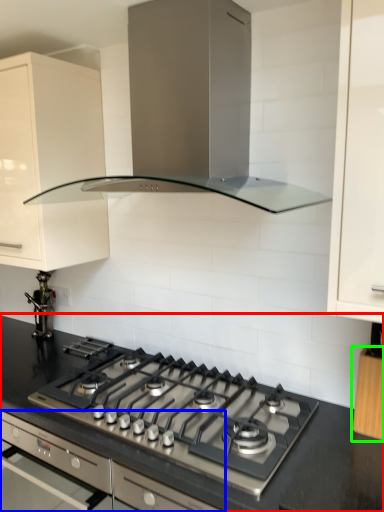
Question: Which object is positioned closest to countertop (highlighted by a red box)? Select from oven (highlighted by a blue box) and cabinetry (highlighted by a green box).

Choices:
 (A) oven
 (B) cabinetry

Answer: (A)